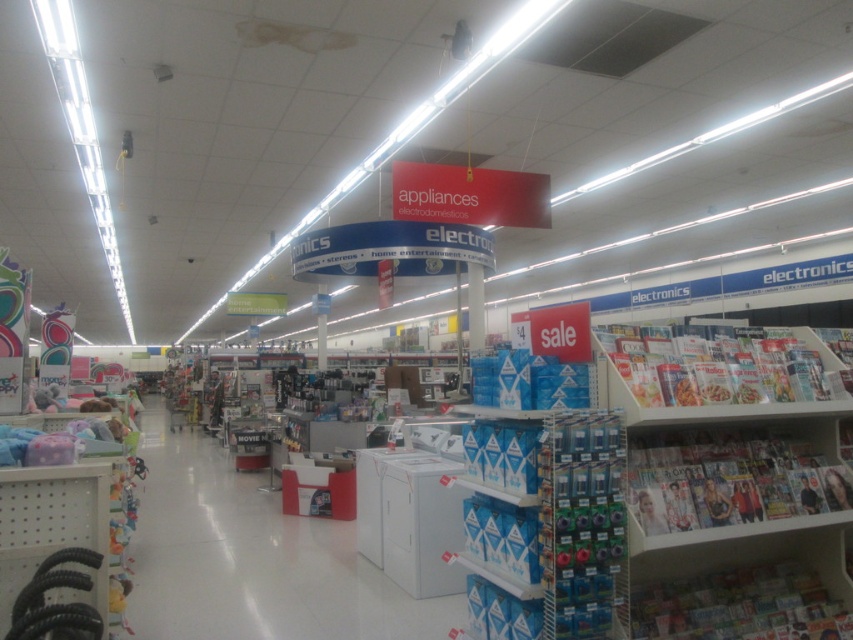
Question: Can you confirm if white glossy magazine rack at lower right is thinner than white plastic magazine rack at right?

Choices:
 (A) yes
 (B) no

Answer: (B)

Question: Is white glossy appliance at center thinner than white glossy magazine rack at lower right?

Choices:
 (A) no
 (B) yes

Answer: (A)

Question: Is white glossy magazine rack at lower right positioned in front of white plastic magazine rack at right?

Choices:
 (A) yes
 (B) no

Answer: (A)

Question: Which object is farther from the camera taking this photo?

Choices:
 (A) white glossy magazine rack at lower right
 (B) white glossy appliance at center

Answer: (B)

Question: Estimate the real-world distances between objects in this image. Which object is closer to the white plastic magazine rack at right?

Choices:
 (A) white glossy magazine rack at lower right
 (B) white glossy appliance at center

Answer: (A)

Question: Among these points, which one is farthest from the camera?

Choices:
 (A) (229, 545)
 (B) (689, 403)
 (C) (722, 504)

Answer: (A)